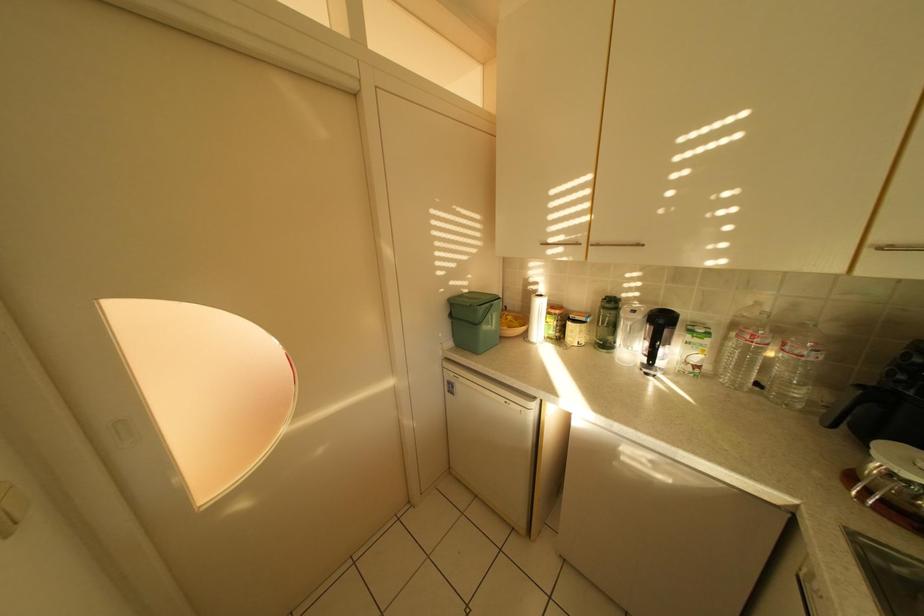
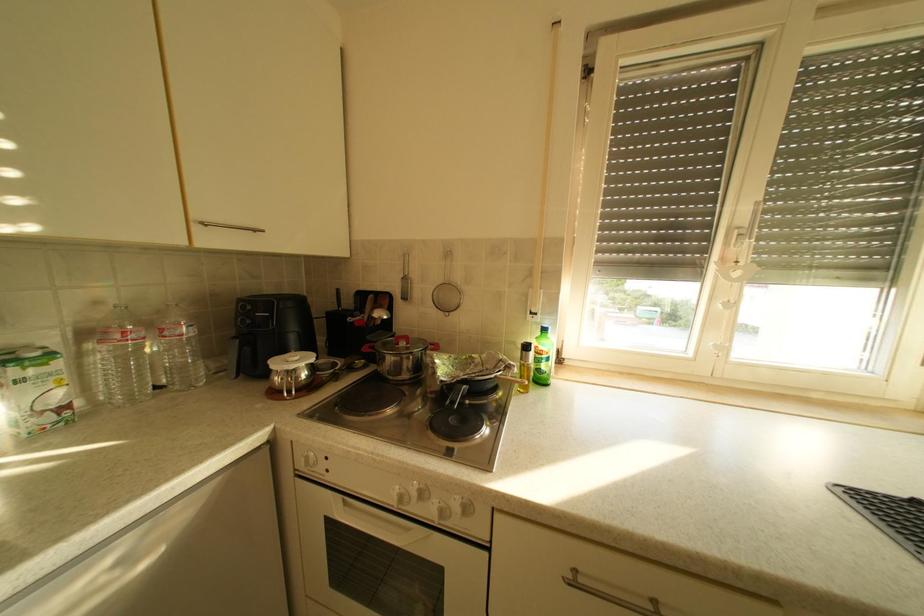
Question: How did the camera likely rotate?

Choices:
 (A) Left
 (B) Right
 (C) Up
 (D) Down

Answer: (B)